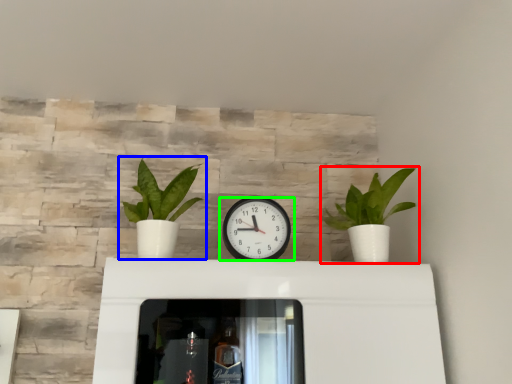
Question: Estimate the real-world distances between objects in this image. Which object is farther from houseplant (highlighted by a red box), houseplant (highlighted by a blue box) or wall clock (highlighted by a green box)?

Choices:
 (A) houseplant
 (B) wall clock

Answer: (A)